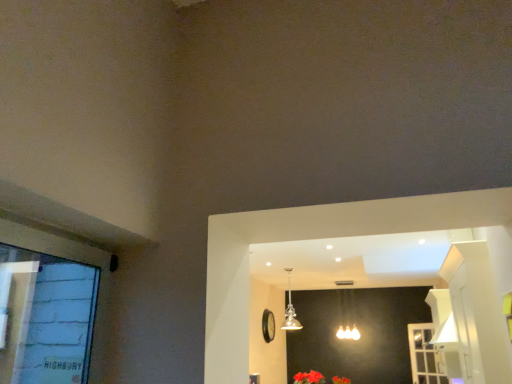
Question: From the image's perspective, is vivid red petals at lower center, which appears as the 2th flower when ordered from the bottom, above or below white plastic screen door at lower right?

Choices:
 (A) below
 (B) above

Answer: (B)

Question: In the image, is vivid red petals at lower center, marked as the 1th flower in a left-to-right arrangement, on the left side or the right side of white plastic screen door at lower right?

Choices:
 (A) right
 (B) left

Answer: (B)

Question: Estimate the real-world distances between objects in this image. Which object is farther from the matte silver lamp at center, arranged as the 2th lamp when viewed from the front?

Choices:
 (A) vivid red petals at lower center, the 2th flower from the back
 (B) fluffy fabric flower at lower center, the first flower viewed from the right
 (C) white plastic screen door at lower right
 (D) gold glass pendant light at center, which is the second lamp from back to front

Answer: (C)

Question: Which of these objects is positioned closest to the white plastic screen door at lower right?

Choices:
 (A) gold glass pendant light at center, which is the second lamp from back to front
 (B) matte silver lamp at center, arranged as the 2th lamp when viewed from the front
 (C) vivid red petals at lower center, the 1th flower when ordered from front to back
 (D) fluffy fabric flower at lower center, arranged as the 1th flower when viewed from the back

Answer: (B)